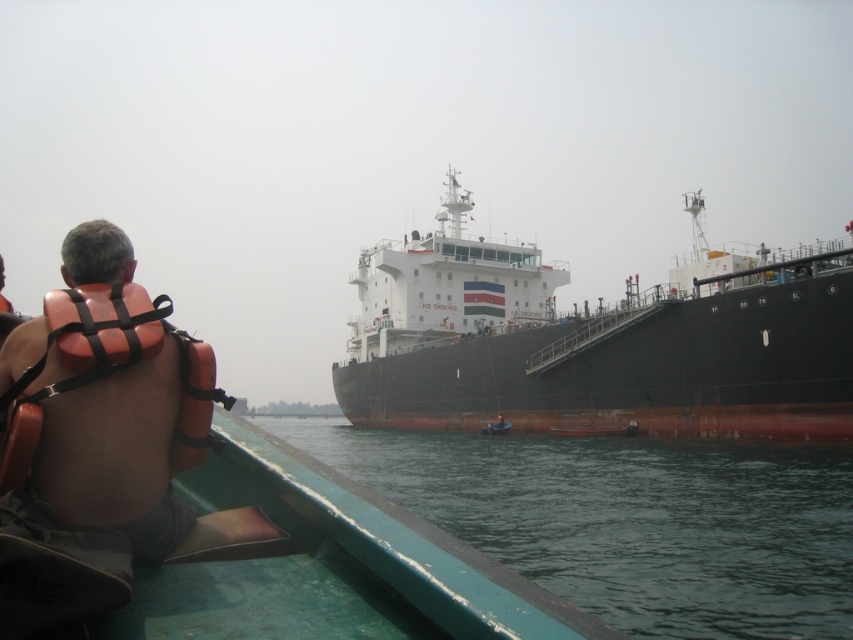
Question: Is black matte ship at center below green water at lower left?

Choices:
 (A) yes
 (B) no

Answer: (B)

Question: Which of the following is the closest to the observer?

Choices:
 (A) (669, 461)
 (B) (36, 392)
 (C) (383, 337)

Answer: (B)

Question: Which point is closer to the camera?

Choices:
 (A) black matte ship at center
 (B) orange life vest at left

Answer: (B)

Question: Can you confirm if black matte ship at center is positioned to the left of green water at lower left?

Choices:
 (A) yes
 (B) no

Answer: (B)

Question: Which point appears farthest from the camera in this image?

Choices:
 (A) (520, 305)
 (B) (50, 353)
 (C) (311, 445)

Answer: (A)

Question: Considering the relative positions of black matte ship at center and green water at lower left in the image provided, where is black matte ship at center located with respect to green water at lower left?

Choices:
 (A) above
 (B) below

Answer: (A)